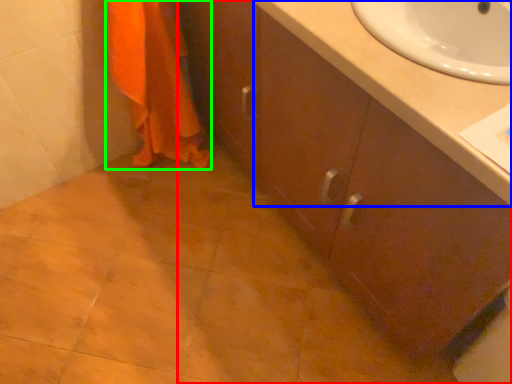
Question: Which object is positioned closest to bathroom cabinet (highlighted by a red box)? Select from counter top (highlighted by a blue box) and bath towel (highlighted by a green box).

Choices:
 (A) counter top
 (B) bath towel

Answer: (A)